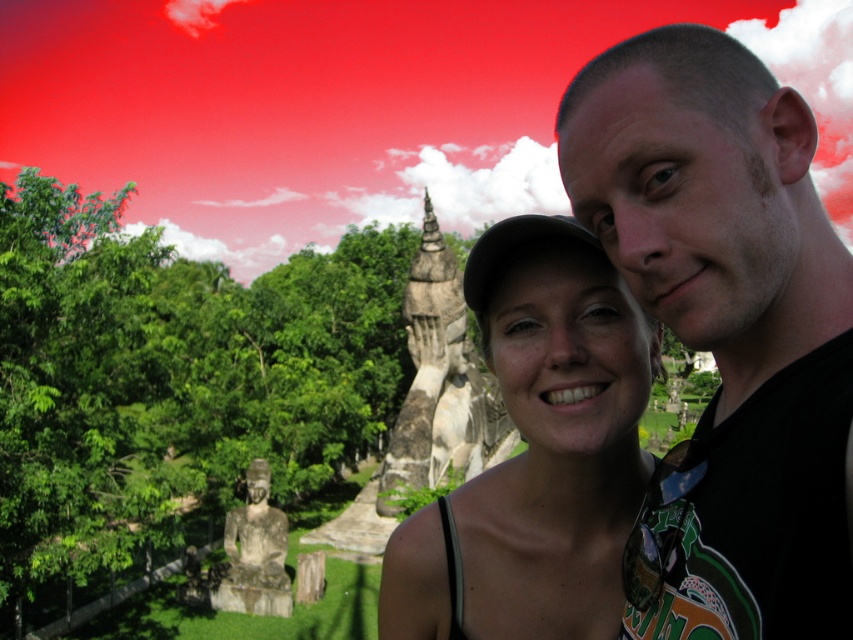
You are a photographer trying to capture a clear shot of the black matte shirt at upper right and the green leafy tree at upper left. Which object is closer to the camera?

The black matte shirt at upper right is in front of the green leafy tree at upper left, so it is closer to the camera.

You are a photographer trying to capture a photo of the two subjects wearing the black matte shirt at upper right and the matte gray statue at center. Based on their widths, which one would you need to zoom in more on to fill the frame?

The black matte shirt at upper right has a lesser width compared to the matte gray statue at center, so you would need to zoom in more on the black matte shirt at upper right to fill the frame since it is smaller in width.

You are a photographer trying to capture a photo of the matte gray statue at center and the green leafy tree at upper left. Which object should you focus on first if you want to include both in your shot without moving the camera?

You should focus on the matte gray statue at center first because the green leafy tree at upper left is positioned on the left side of it, meaning the tree is closer to the edge of the frame. By centering the statue, you can ensure the tree remains within the shot without needing to reposition the camera.